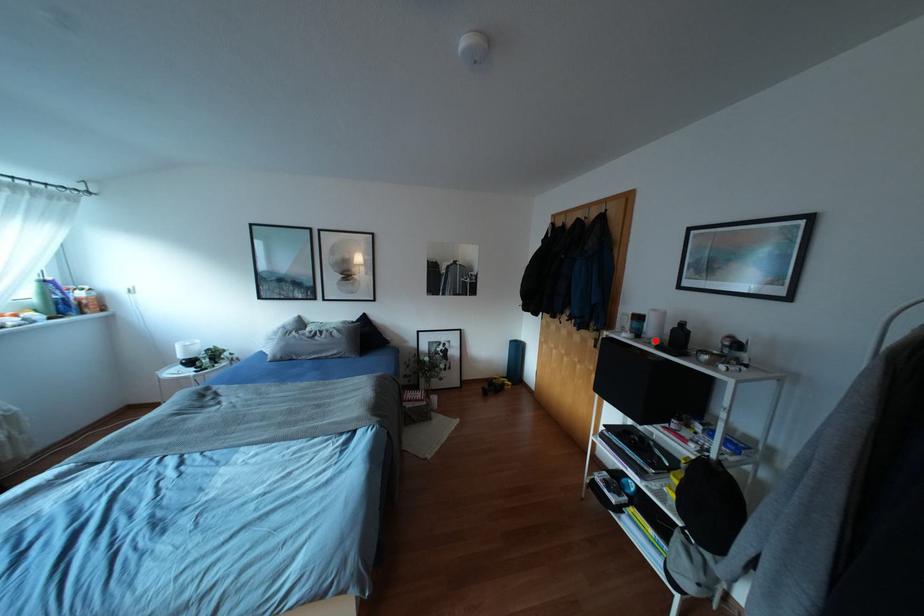
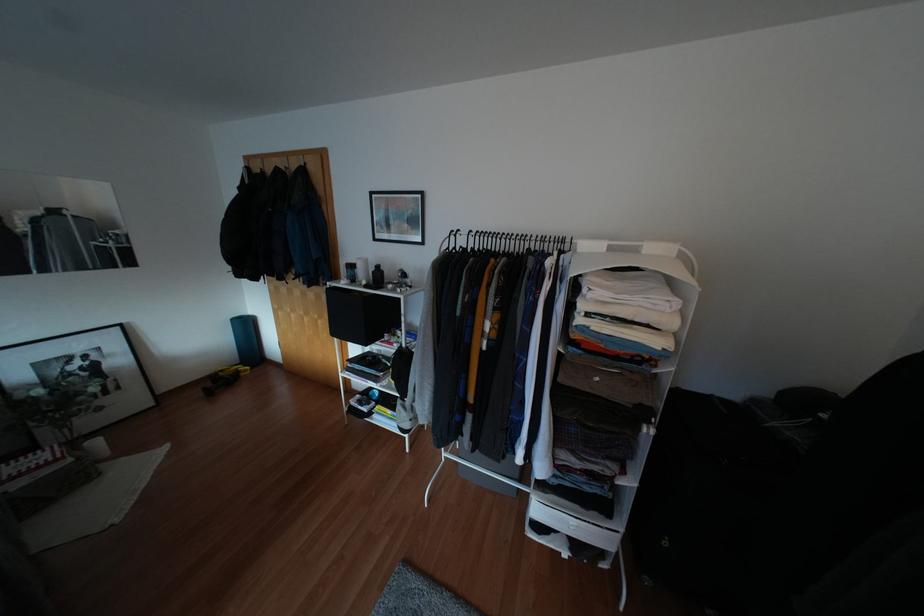
In the second image, find the point that corresponds to the highlighted location in the first image.

(362, 282)